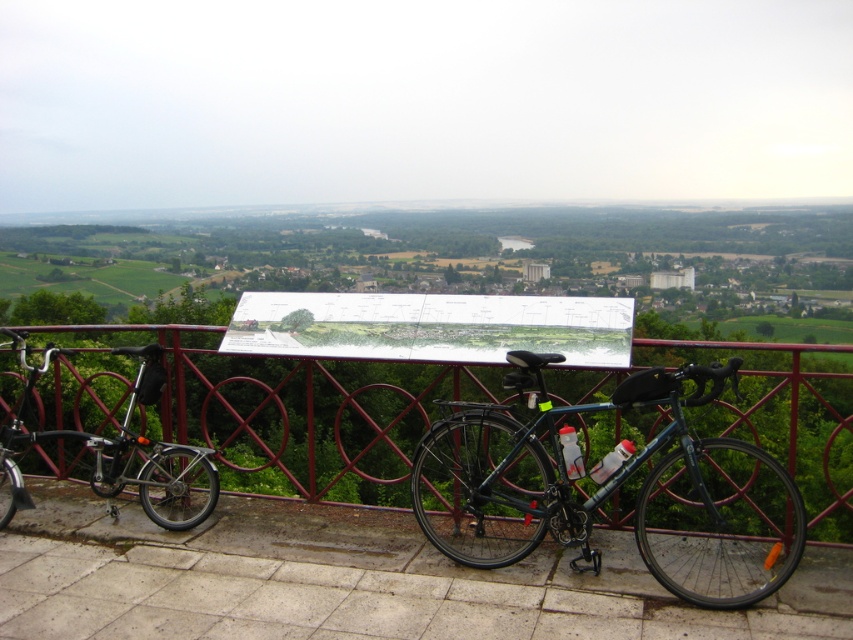
You are standing at the point labeled as point (265, 408) in the image. What object is directly in front of you?

The metallic red fence at center is directly in front of you at point (265, 408).

You are standing at the camera position and want to reach the point marked at coordinates (819,476). The path is clear except for a small stream that runs diagonally from the bottom left to the top right of the scene. The stream is 2 meters wide. Will you be able to cross the stream to reach the point without getting your shoes wet?

The point marked at coordinates (819,476) is 7.73 meters away from the camera position. However, the stream is only 2 meters wide. Since the stream is narrower than the distance to the point, you can likely cross it without getting your shoes wet by stepping over it. However, the exact path depends on the stream location relative to the point.